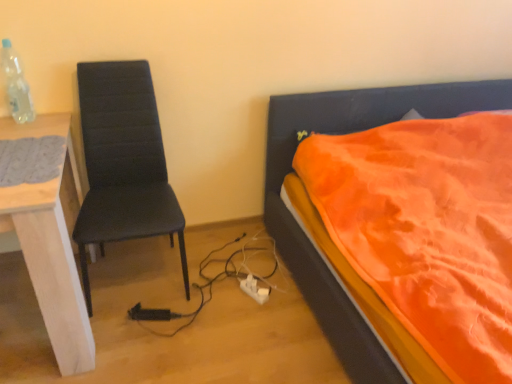
Image resolution: width=512 pixels, height=384 pixels. What are the coordinates of `vacant space situated above gray knitted mat at left (from a real-world perspective)` in the screenshot? It's located at point(21,157).